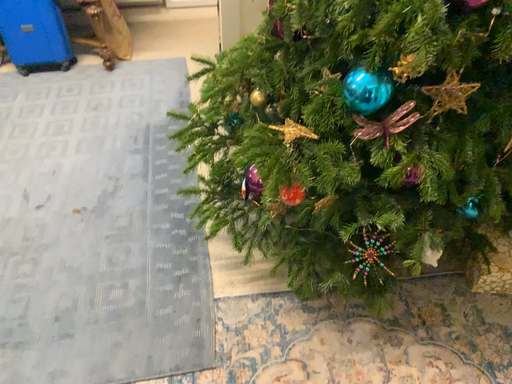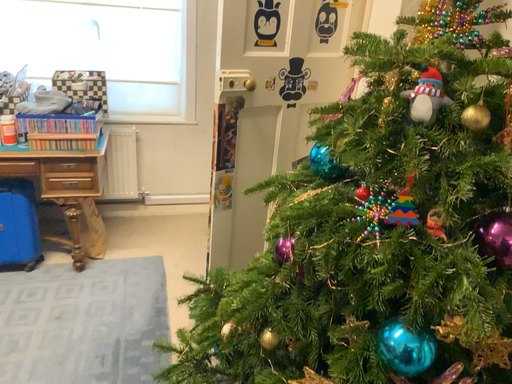
Question: How did the camera likely rotate when shooting the video?

Choices:
 (A) rotated downward
 (B) rotated upward

Answer: (B)